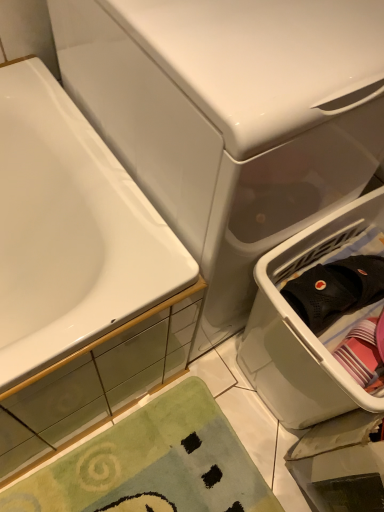
Question: In terms of height, does white glossy bathtub at left look taller or shorter compared to white glossy water tank at upper center?

Choices:
 (A) short
 (B) tall

Answer: (A)

Question: In terms of size, does white glossy bathtub at left appear bigger or smaller than white glossy water tank at upper center?

Choices:
 (A) big
 (B) small

Answer: (B)

Question: Which is nearer to the black mesh clothing at right?

Choices:
 (A) green plush bath mat at lower left
 (B) white glossy water tank at upper center
 (C) white glossy bathtub at left
 (D) white plastic laundry basket at right

Answer: (D)

Question: Which of these objects is positioned farthest from the white plastic laundry basket at right?

Choices:
 (A) white glossy bathtub at left
 (B) white glossy water tank at upper center
 (C) green plush bath mat at lower left
 (D) black mesh clothing at right

Answer: (A)